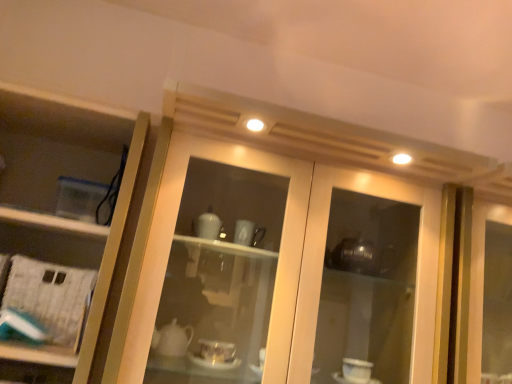
Question: From the image's perspective, is white paper at left located above or below clear plastic container at left?

Choices:
 (A) below
 (B) above

Answer: (A)

Question: Considering the positions of white paper at left and clear plastic container at left in the image, is white paper at left wider or thinner than clear plastic container at left?

Choices:
 (A) wide
 (B) thin

Answer: (B)

Question: Which object is positioned closest to the white paper at left?

Choices:
 (A) matte glass cabinet at center
 (B) clear plastic container at left

Answer: (B)

Question: Which object is positioned closest to the clear plastic container at left?

Choices:
 (A) matte glass cabinet at center
 (B) white paper at left

Answer: (B)